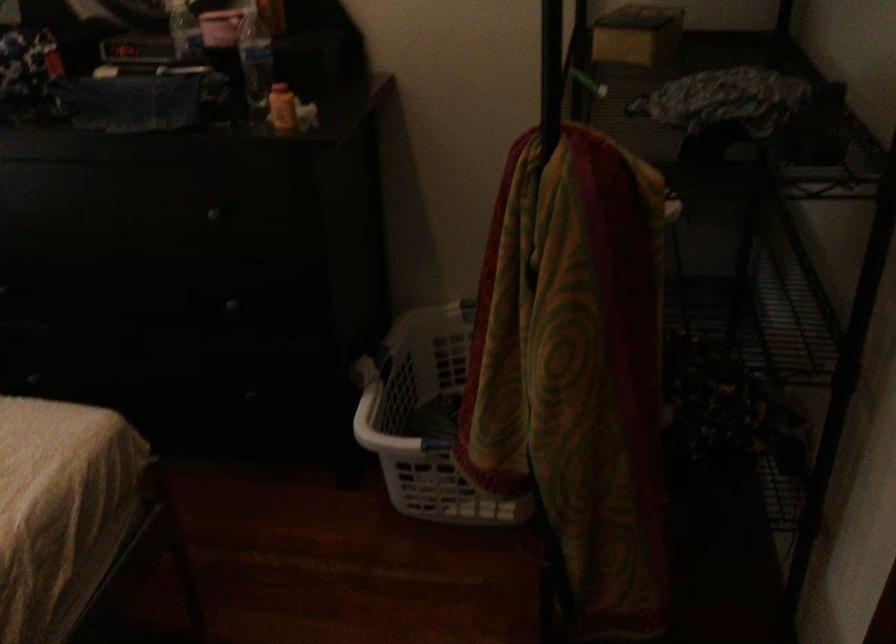
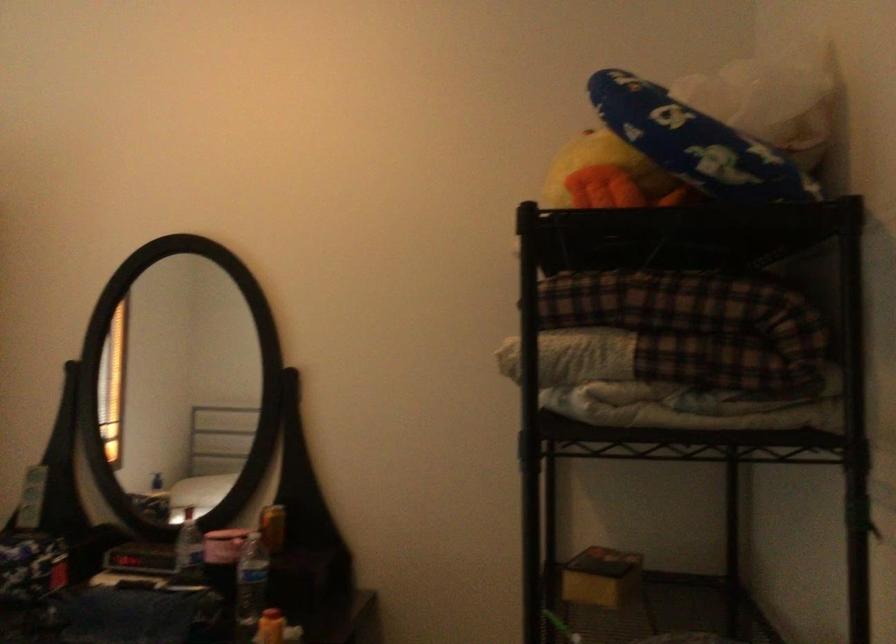
Where in the second image is the point corresponding to point (282, 95) from the first image?

(270, 627)